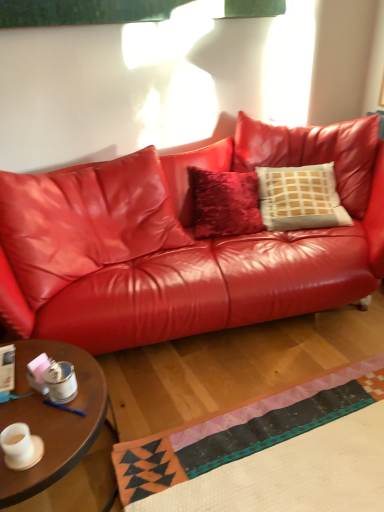
Identify the location of free space above wooden round table at lower left (from a real-world perspective). (50, 392).